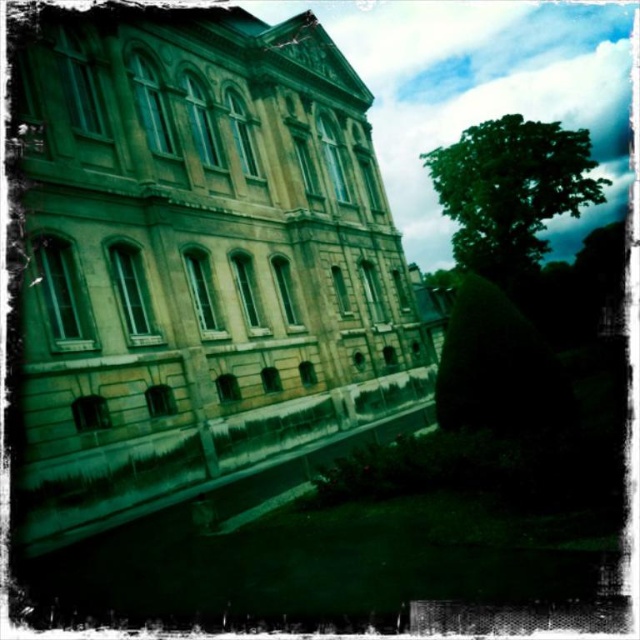
You are standing on the lawn in front of the stone building at center. You want to take a photo of the building with the green leafy tree at upper right in the background. Will the tree be fully visible in the photo if you frame the building in the center?

The stone building at center is shorter than the green leafy tree at upper right, so the tree will be fully visible in the photo as it is taller than the building.

You are standing on the lawn in front of the stone building at center. You want to walk towards the green leafy tree at upper right. Which direction should you move relative to the building?

Since the stone building at center is closer to the viewer than the green leafy tree at upper right, you should move towards the upper right direction away from the building to reach the tree.

You are standing at a distance from the stone building at center. If you want to take a photo of it using a standard camera lens with a focal length of 50mm, would you need to move closer or farther away to ensure the entire building fits within the camera frame?

The stone building at center is 160.95 feet away from the camera. To ensure the entire building fits within the camera frame using a 50mm lens, you would need to move farther away because the current distance might be too close for the lens to capture the full structure.